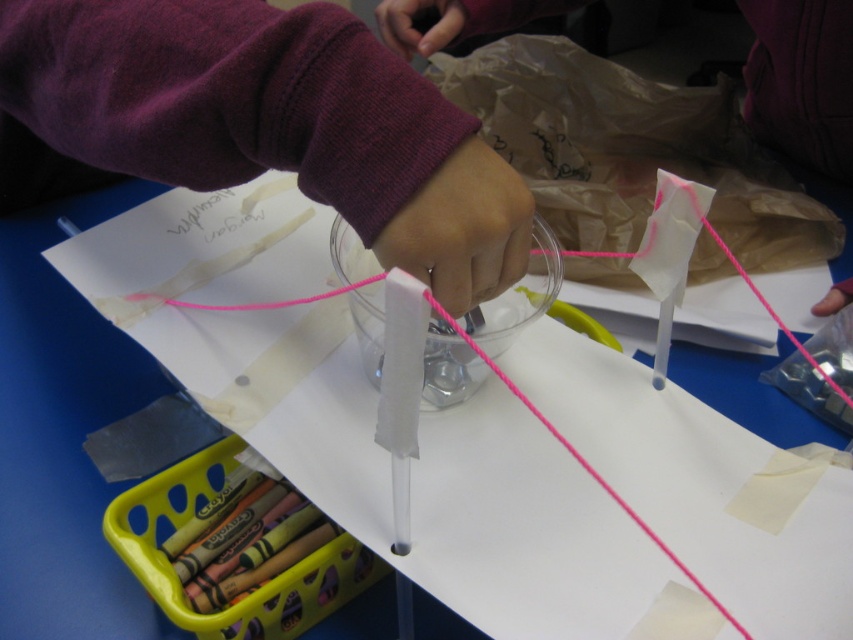
Question: Is white matte paper at center further to the viewer compared to pink matte string at center?

Choices:
 (A) no
 (B) yes

Answer: (A)

Question: Which object is the closest to the purple fleece sleeve at upper center?

Choices:
 (A) white matte paper at center
 (B) pink matte string at center

Answer: (A)

Question: Which of the following is the farthest from the observer?

Choices:
 (A) pink matte string at center
 (B) white matte paper at center
 (C) purple fleece sleeve at upper center

Answer: (A)

Question: In this image, where is purple fleece sleeve at upper center located relative to pink matte string at center?

Choices:
 (A) left
 (B) right

Answer: (A)

Question: Among these objects, which one is nearest to the camera?

Choices:
 (A) pink matte string at center
 (B) purple fleece sleeve at upper center

Answer: (B)

Question: Does white matte paper at center appear on the right side of pink matte string at center?

Choices:
 (A) no
 (B) yes

Answer: (A)